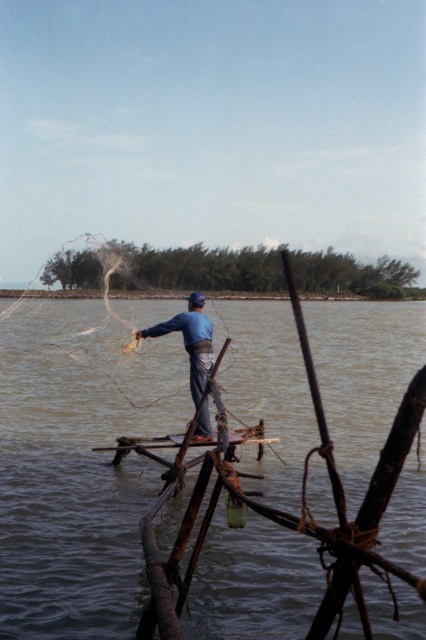
Question: Is brown muddy water at center to the right of blue fabric fisherman at center from the viewer's perspective?

Choices:
 (A) no
 (B) yes

Answer: (B)

Question: Does brown muddy water at center have a smaller size compared to blue fabric fisherman at center?

Choices:
 (A) yes
 (B) no

Answer: (B)

Question: Which object appears closest to the camera in this image?

Choices:
 (A) blue fabric fisherman at center
 (B) brown muddy water at center

Answer: (B)

Question: Is brown muddy water at center to the right of blue fabric fisherman at center from the viewer's perspective?

Choices:
 (A) no
 (B) yes

Answer: (B)